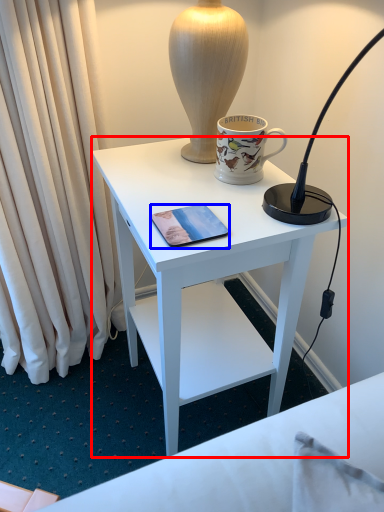
Question: Which of the following is the farthest to the observer, desk (highlighted by a red box) or mobile phone (highlighted by a blue box)?

Choices:
 (A) desk
 (B) mobile phone

Answer: (B)